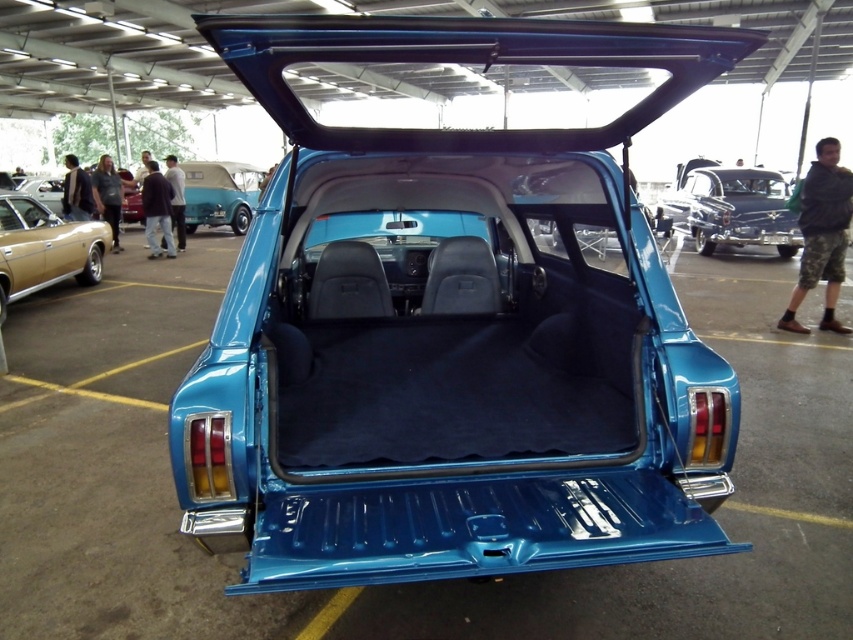
Question: Is the position of shiny blue car at center less distant than that of matte black car at upper left?

Choices:
 (A) yes
 (B) no

Answer: (B)

Question: Based on their relative distances, which object is nearer to the matte black car at upper left?

Choices:
 (A) shiny blue sedan at center
 (B) shiny blue car at center
 (C) gold metallic sedan at left

Answer: (B)

Question: Which point is closer to the camera?

Choices:
 (A) pos(743,237)
 (B) pos(86,253)
 (C) pos(32,195)

Answer: (B)

Question: Among these objects, which one is farthest from the camera?

Choices:
 (A) matte black car at upper left
 (B) gold metallic sedan at left
 (C) shiny blue car at center

Answer: (C)

Question: Is shiny blue car at center below matte black car at upper left?

Choices:
 (A) yes
 (B) no

Answer: (B)

Question: Observing the image, what is the correct spatial positioning of shiny blue car at center in reference to matte black car at upper left?

Choices:
 (A) left
 (B) right

Answer: (B)